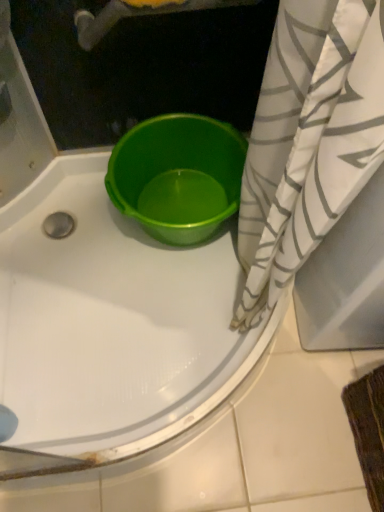
Question: From the image's perspective, is white/gray striped fabric at right located above or below matte green tub at center?

Choices:
 (A) below
 (B) above

Answer: (A)

Question: Is white/gray striped fabric at right wider or thinner than matte green tub at center?

Choices:
 (A) thin
 (B) wide

Answer: (A)

Question: Which of these objects is positioned farthest from the green plastic bucket at center?

Choices:
 (A) matte green tub at center
 (B) white/gray striped fabric at right

Answer: (B)

Question: Which of these objects is positioned farthest from the matte green tub at center?

Choices:
 (A) green plastic bucket at center
 (B) white/gray striped fabric at right

Answer: (B)